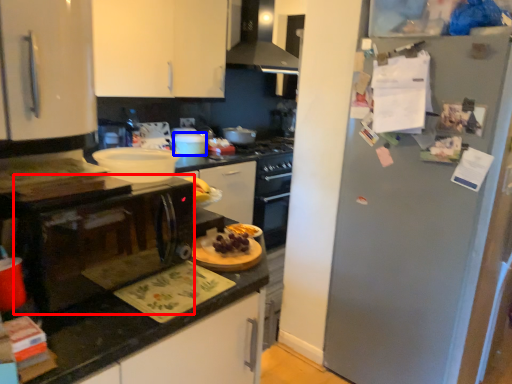
Question: Which object appears closest to the camera in this image, microwave (highlighted by a red box) or appliance (highlighted by a blue box)?

Choices:
 (A) microwave
 (B) appliance

Answer: (A)